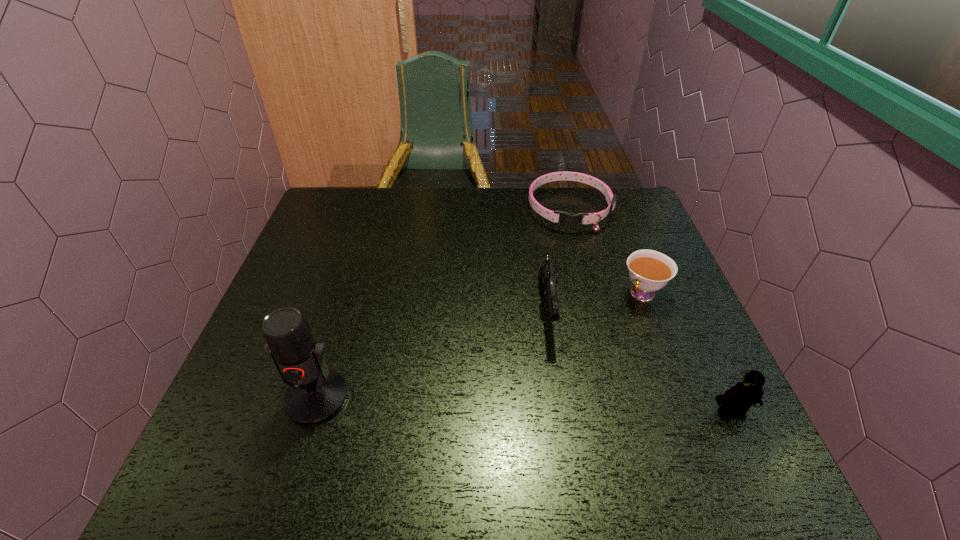
At what (x,y) coordinates should I click in order to perform the action: click on microphone. Please return your answer as a coordinate pair (x, y). Looking at the image, I should click on (316, 394).

Locate an element on the screen. The image size is (960, 540). the leftmost object is located at coordinates (316, 394).

At what (x,y) coordinates should I click in order to perform the action: click on Lego. Please return your answer as a coordinate pair (x, y). Looking at the image, I should click on (735, 402).

The height and width of the screenshot is (540, 960). In order to click on the fourth tallest object in this screenshot , I will do `click(649, 270)`.

You are a GUI agent. You are given a task and a screenshot of the screen. Output one action in this format:
    pyautogui.click(x=<x>, y=<y>)
    Task: Click on the shortest object
    
    Given the screenshot: What is the action you would take?
    pyautogui.click(x=568, y=219)

What are the coordinates of `dog collar` in the screenshot? It's located at (568, 219).

This screenshot has width=960, height=540. I want to click on gun, so click(x=547, y=277).

Locate an element on the screen. blank area located 0.120m on the side of the fourth tallest object with the handle is located at coordinates (605, 334).

Identify the location of free region located 0.320m on the side of the fourth tallest object with the handle. (555, 388).

At what (x,y) coordinates should I click in order to perform the action: click on vacant space located on the side of the fourth tallest object with the handle. Please return your answer as a coordinate pair (x, y). This screenshot has height=540, width=960. Looking at the image, I should click on (590, 349).